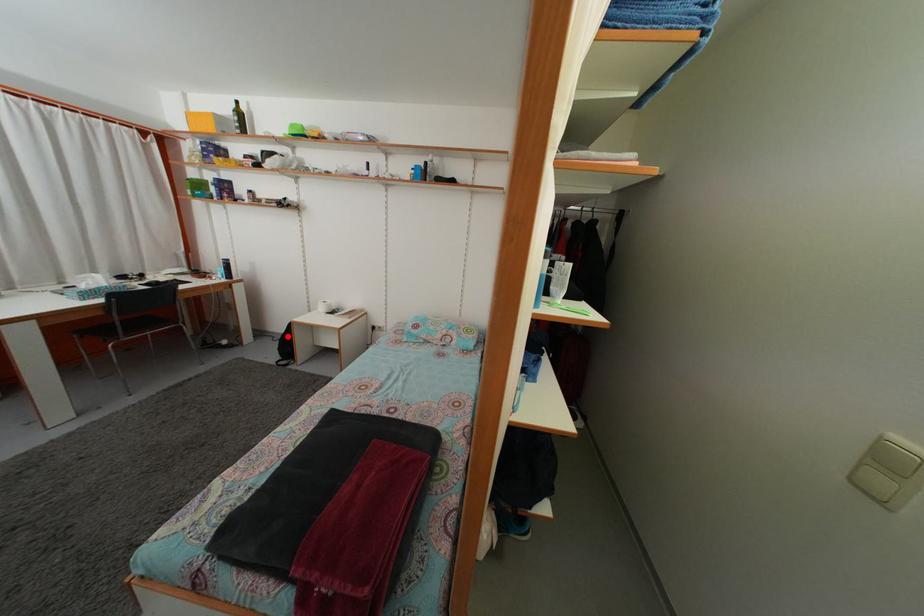
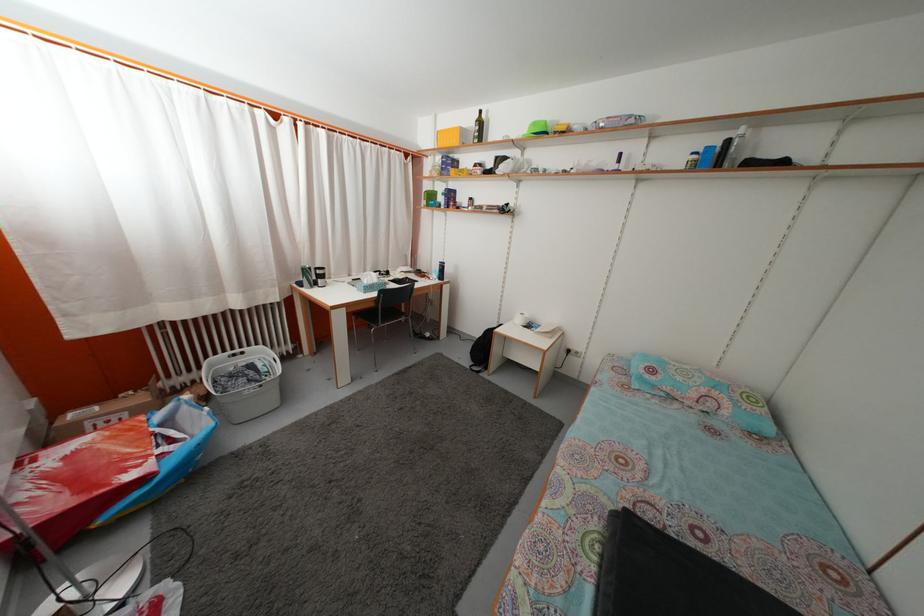
The point at the highlighted location is marked in the first image. Where is the corresponding point in the second image?

(482, 342)